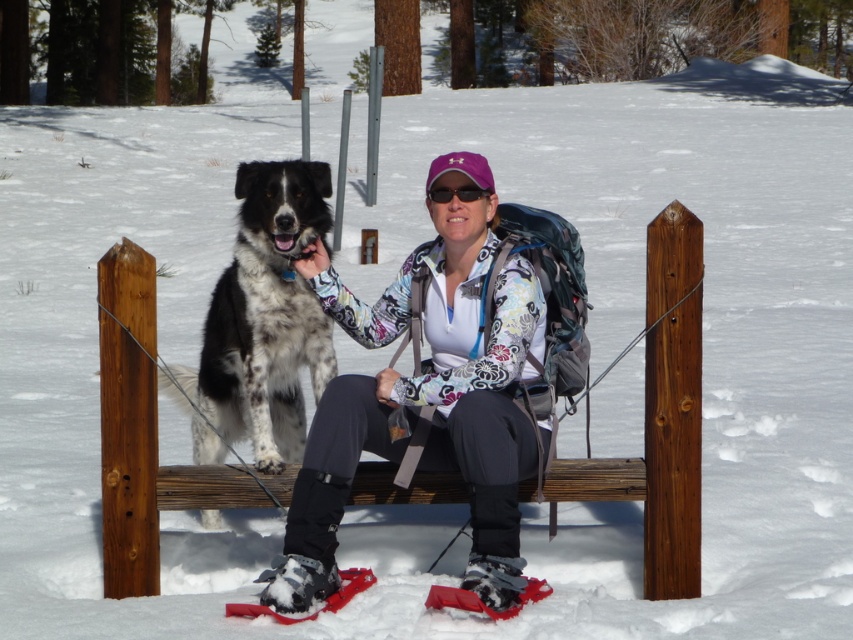
Question: Among these points, which one is nearest to the camera?

Choices:
 (A) (480, 600)
 (B) (283, 387)
 (C) (311, 592)
 (D) (700, 227)

Answer: (A)

Question: Is the position of wooden bench at center less distant than that of white textured ski boot at lower center?

Choices:
 (A) yes
 (B) no

Answer: (B)

Question: Which point is farther to the camera?

Choices:
 (A) gray fabric ski boot at lower center
 (B) wooden bench at center

Answer: (B)

Question: Is wooden bench at center positioned in front of gray fabric ski boot at lower center?

Choices:
 (A) yes
 (B) no

Answer: (B)

Question: Is the position of wooden bench at center more distant than that of white textured ski boot at lower center?

Choices:
 (A) no
 (B) yes

Answer: (B)

Question: Based on their relative distances, which object is nearer to the matte black goggles at center?

Choices:
 (A) spotted fur dog at center
 (B) floral-patterned jacket at center
 (C) gray fabric ski boot at lower center
 (D) white textured ski boot at lower center

Answer: (B)